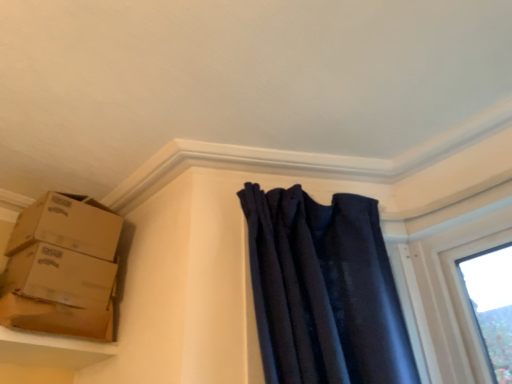
Question: Considering the positions of smooth beige shelf at lower left and brown cardboard boxes at left, marked as the 2th box in a top-to-bottom arrangement, in the image, is smooth beige shelf at lower left taller or shorter than brown cardboard boxes at left, marked as the 2th box in a top-to-bottom arrangement,?

Choices:
 (A) short
 (B) tall

Answer: (A)

Question: Would you say smooth beige shelf at lower left is to the left or to the right of brown cardboard boxes at left, the first box when ordered from bottom to top, in the picture?

Choices:
 (A) left
 (B) right

Answer: (A)

Question: Which of these objects is positioned farthest from the brown cardboard boxes at upper left, the 2th box in the bottom-to-top sequence?

Choices:
 (A) brown cardboard boxes at left, marked as the 2th box in a top-to-bottom arrangement
 (B) brown cardboard box at left
 (C) smooth beige shelf at lower left

Answer: (C)

Question: Considering the real-world distances, which object is farthest from the brown cardboard boxes at upper left, the 2th box in the bottom-to-top sequence?

Choices:
 (A) smooth beige shelf at lower left
 (B) brown cardboard boxes at left, the first box when ordered from bottom to top
 (C) brown cardboard box at left

Answer: (A)